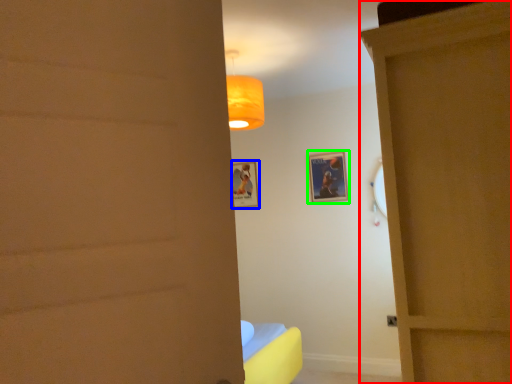
Question: Which is nearer to the door (highlighted by a red box)? picture frame (highlighted by a blue box) or picture frame (highlighted by a green box).

Choices:
 (A) picture frame
 (B) picture frame

Answer: (B)